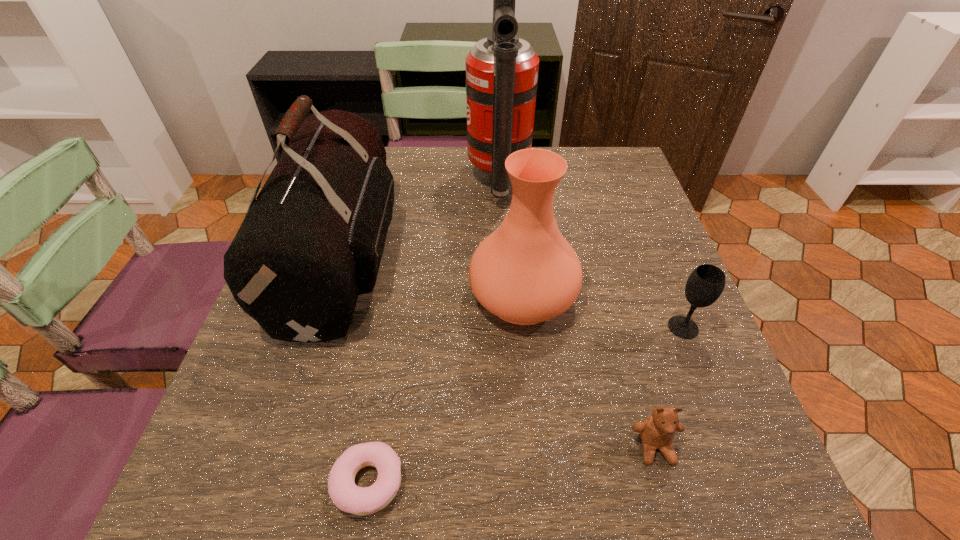
You are a GUI agent. You are given a task and a screenshot of the screen. Output one action in this format:
    pyautogui.click(x=<x>, y=<y>)
    Task: Click on the blank space located on the front label side of the tallest object
    
    Given the screenshot: What is the action you would take?
    pyautogui.click(x=374, y=181)

Where is `blank space located 0.240m on the front pocket of the duffel bag`? blank space located 0.240m on the front pocket of the duffel bag is located at coordinates (503, 258).

The image size is (960, 540). In order to click on free space located 0.210m on the front of the vase in this screenshot , I will do pyautogui.click(x=537, y=450).

Locate an element on the screen. The width and height of the screenshot is (960, 540). vacant region located on the front of the rightmost object is located at coordinates (699, 367).

Locate an element on the screen. free space located 0.060m on the right of the shortest object is located at coordinates (445, 482).

You are a GUI agent. You are given a task and a screenshot of the screen. Output one action in this format:
    pyautogui.click(x=<x>, y=<y>)
    Task: Click on the fire extinguisher situated at the far edge
    
    Given the screenshot: What is the action you would take?
    pyautogui.click(x=502, y=70)

Identify the location of duffel bag positioned at the far edge. (312, 241).

Find the location of a particular element. The height and width of the screenshot is (540, 960). teddy bear located in the near edge section of the desktop is located at coordinates (657, 431).

Locate an element on the screen. This screenshot has height=540, width=960. doughnut situated at the near edge is located at coordinates (346, 495).

This screenshot has height=540, width=960. Find the location of `object that is at the left edge`. object that is at the left edge is located at coordinates (312, 241).